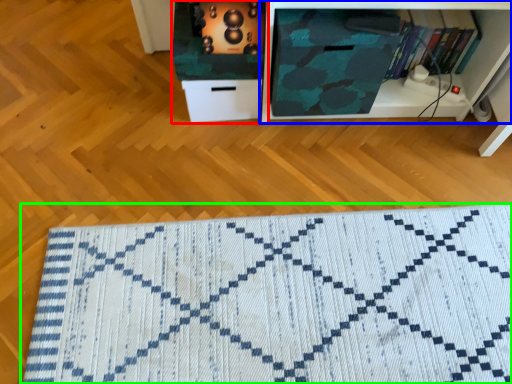
Question: Which object is positioned farthest from cabinetry (highlighted by a red box)? Select from shelf (highlighted by a blue box) and doormat (highlighted by a green box).

Choices:
 (A) shelf
 (B) doormat

Answer: (B)